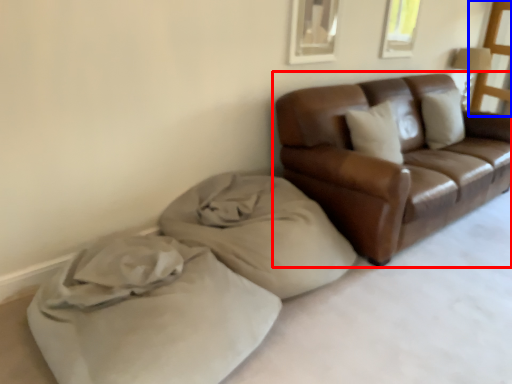
Question: Which point is closer to the camera, studio couch (highlighted by a red box) or window screen (highlighted by a blue box)?

Choices:
 (A) studio couch
 (B) window screen

Answer: (A)